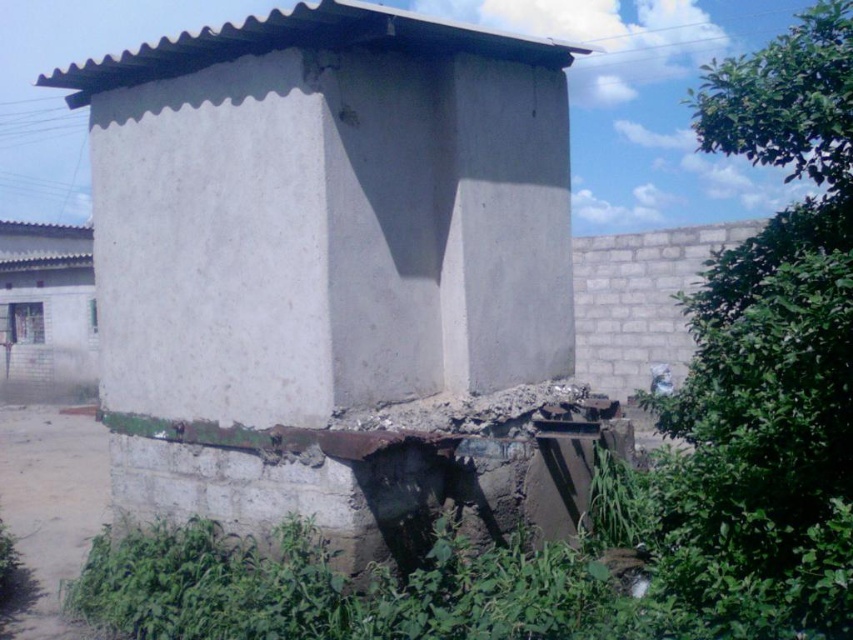
Question: Is white concrete hut at center bigger than white concrete hut at left?

Choices:
 (A) no
 (B) yes

Answer: (A)

Question: Is white concrete hut at center bigger than white concrete hut at left?

Choices:
 (A) no
 (B) yes

Answer: (A)

Question: Which of the following is the closest to the observer?

Choices:
 (A) (426, 225)
 (B) (71, 353)

Answer: (A)

Question: Is white concrete hut at center above white concrete hut at left?

Choices:
 (A) yes
 (B) no

Answer: (B)